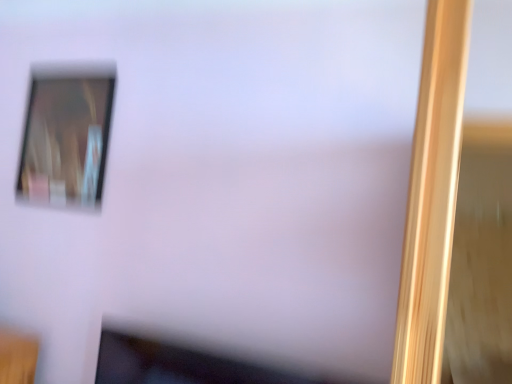
Where is `clear glass window at upper left`? Image resolution: width=512 pixels, height=384 pixels. clear glass window at upper left is located at coordinates (66, 136).

Describe the element at coordinates (66, 136) in the screenshot. Image resolution: width=512 pixels, height=384 pixels. I see `clear glass window at upper left` at that location.

Identify the location of clear glass window at upper left. (66, 136).